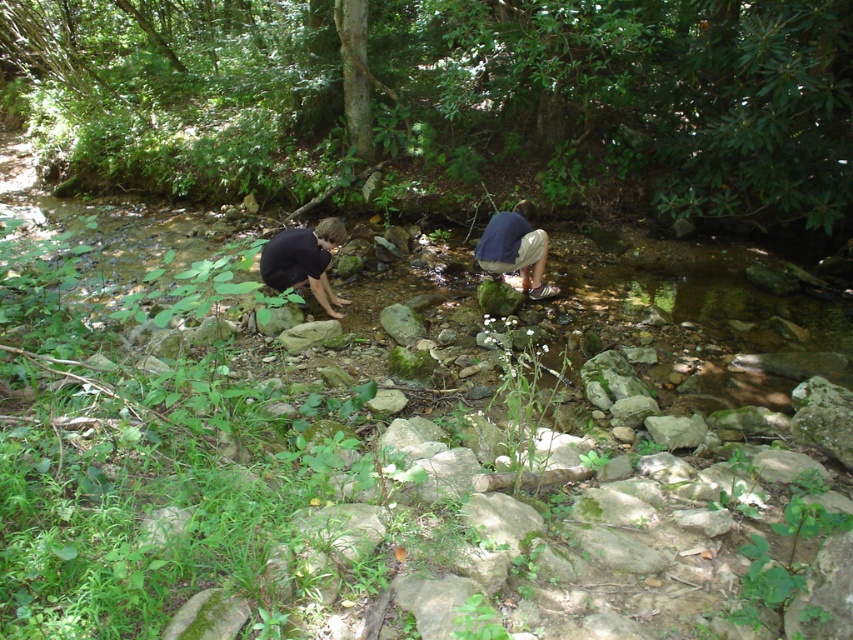
You are standing at the point with coordinates point [514,268] and want to reach the point with coordinates point [308,234]. Which direction should you move in to get there?

You should move forward because point [308,234] is in front of point [514,268].

You are planning to set up a small picnic area in the scene. Given the presence of the green leafy forest at center and the dark blue fabric at center, which object would provide more space for spreading out a picnic blanket?

The green leafy forest at center has a larger width than the dark blue fabric at center, so it would provide more space for spreading out a picnic blanket.